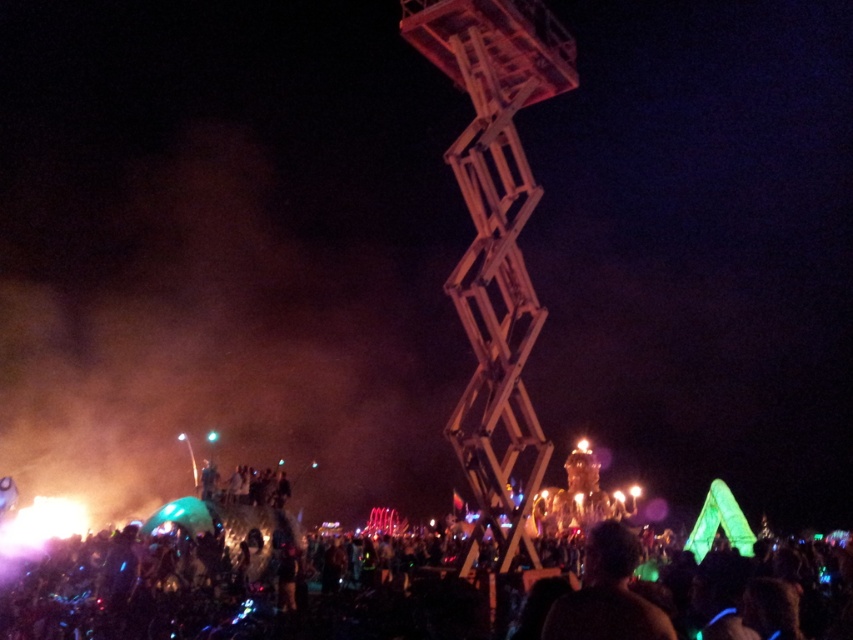
You are at a festival and see the wooden at center. Where is the black matte crowd at lower center in relation to it?

The black matte crowd at lower center is to the left of wooden at center.

Looking at this image, you are a photographer at the festival and want to capture both the black matte crowd at lower center and the dark skin textured crowd at lower center in the same frame. Which crowd should you focus on to ensure both are in focus without adjusting your camera settings?

You should focus on the black matte crowd at lower center because it is in front of the dark skin textured crowd at lower center, so if you focus on the front crowd, the one further back will still be in focus.

You are standing at the origin point in the scene and want to reach the black matte crowd at lower center. According to the coordinates provided, in which direction should you move to get there?

The black matte crowd at lower center is located at coordinates point (254,600). Since the x coordinate is 0.939 and y is 0.299, you should move to the right and slightly downward from your current position at the origin to reach them.